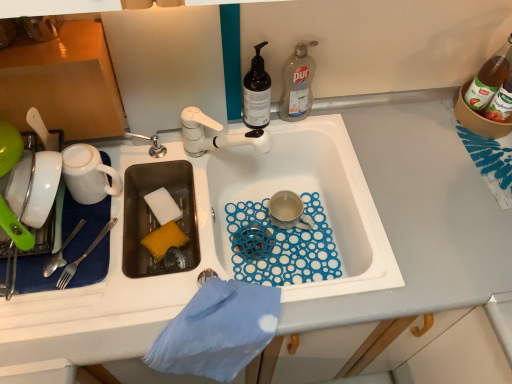
I want to click on free location in front of translucent glass bottle at upper right, the first bottle in the right-to-left sequence, so click(x=468, y=162).